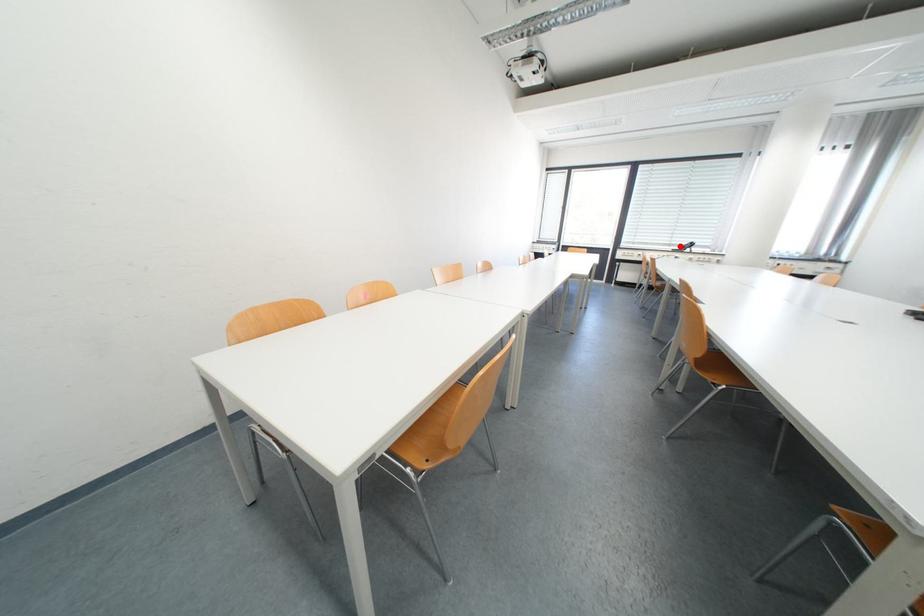
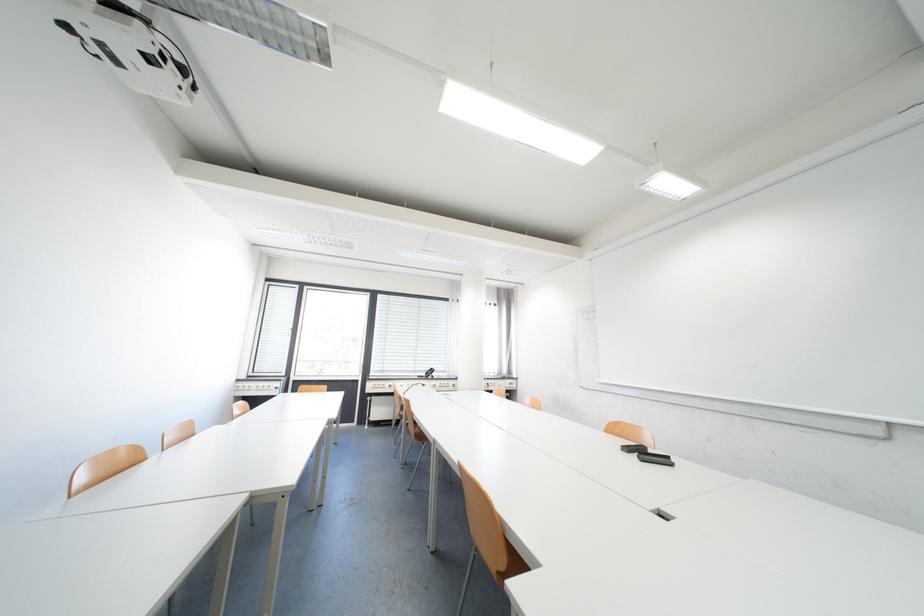
In the second image, find the point that corresponds to the highlighted location in the first image.

(426, 371)